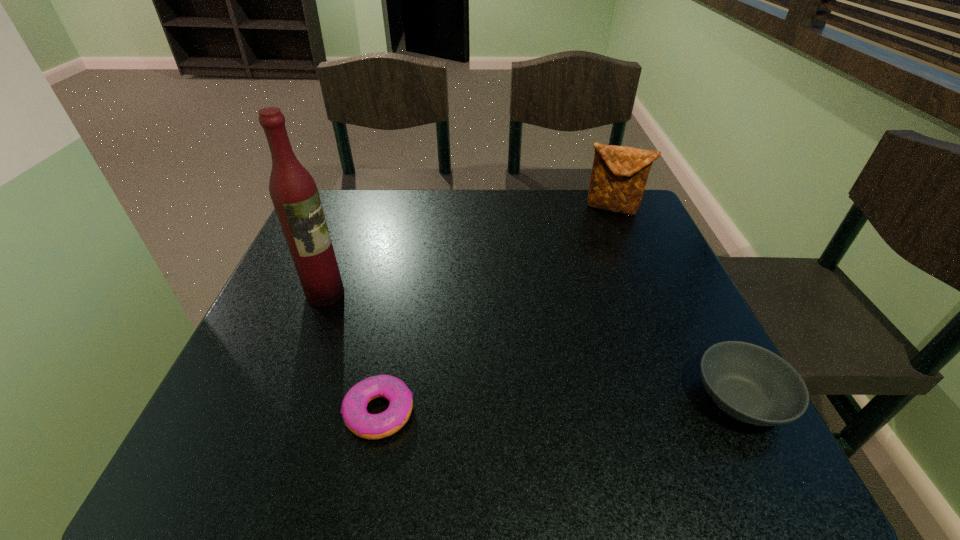
Locate an element on the screen. free space on the desktop that is between the second object from left to right and the second shortest object and is positioned on the label of the tallest object is located at coordinates (528, 407).

Locate an element on the screen. The height and width of the screenshot is (540, 960). vacant space on the desktop that is between the doughnut and the soup bowl and is positioned on the open side of the farthest object is located at coordinates (520, 407).